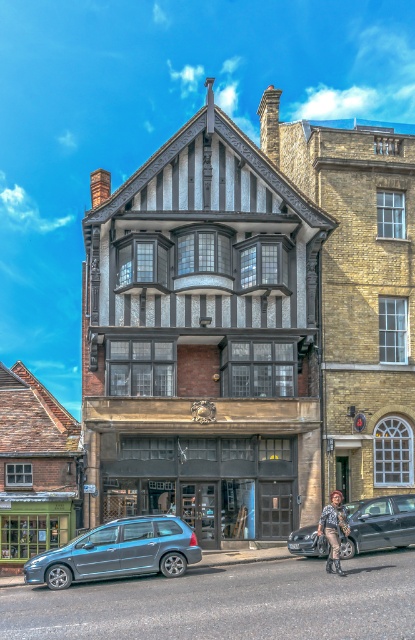
You are a delivery person standing in front of the historic building. You need to place a package on the leather jacket at lower right. However, there is a shiny black car at lower right in the way. Can you place the package on the jacket without moving the car?

The shiny black car at lower right is positioned under the leather jacket at lower right, so the car is blocking the jacket. Therefore, you cannot place the package on the jacket without moving the car.

You are a delivery person trying to reach the entrance of the historic building. There is a metallic blue minivan at lower left and a leather jacket at lower right in your way. Which object is blocking your path closer to the entrance?

The metallic blue minivan at lower left is positioned under leather jacket at lower right, so the metallic blue minivan at lower left is closer to the entrance and is blocking your path.

You are standing in front of the historic Tudor building and notice a shiny black car at lower right and a leather jacket at lower right. Which object is closer to you?

The shiny black car at lower right is closer to you because it is further to the viewer than the leather jacket at lower right.